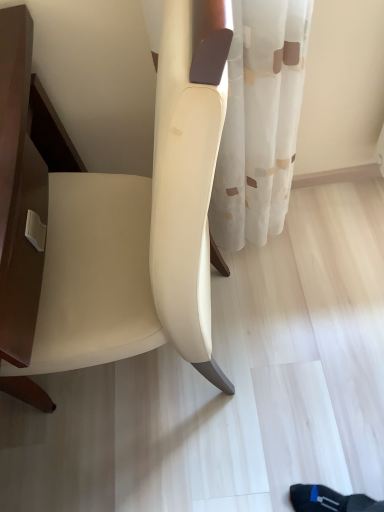
Identify the location of matte white chair at left. This screenshot has width=384, height=512. (140, 226).

Measure the distance between matte white chair at left and camera.

matte white chair at left is 12.39 inches away from camera.

What do you see at coordinates (140, 226) in the screenshot? This screenshot has height=512, width=384. I see `matte white chair at left` at bounding box center [140, 226].

This screenshot has height=512, width=384. I want to click on matte white chair at left, so click(140, 226).